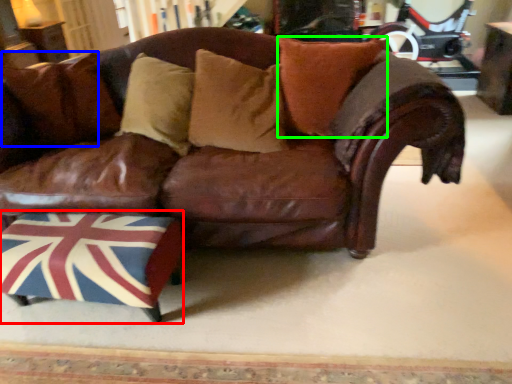
Question: Considering the real-world distances, which object is farthest from swivel chair (highlighted by a red box)? pillow (highlighted by a blue box) or pillow (highlighted by a green box)?

Choices:
 (A) pillow
 (B) pillow

Answer: (B)